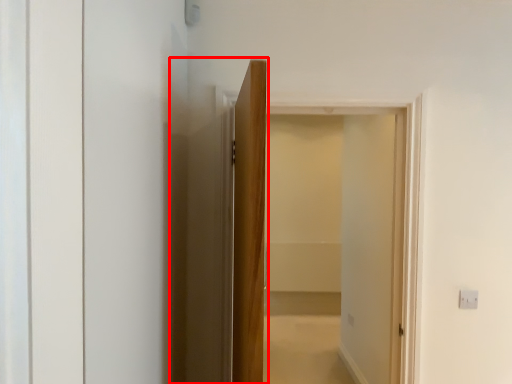
Question: Where is elevator (annotated by the red box) located in relation to screen door in the image?

Choices:
 (A) left
 (B) right

Answer: (A)